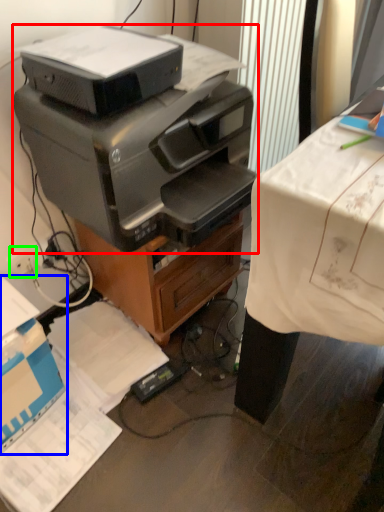
Question: Which is farther away from printer (highlighted by a red box)? cardboard box (highlighted by a blue box) or plug (highlighted by a green box)?

Choices:
 (A) cardboard box
 (B) plug

Answer: (B)